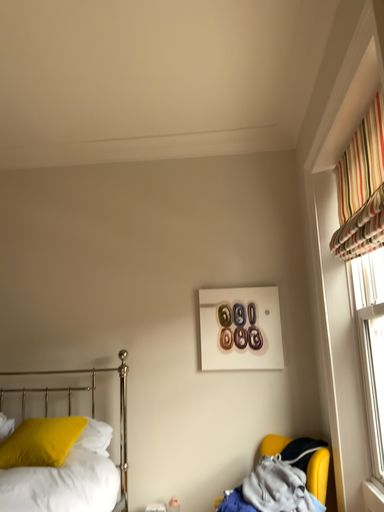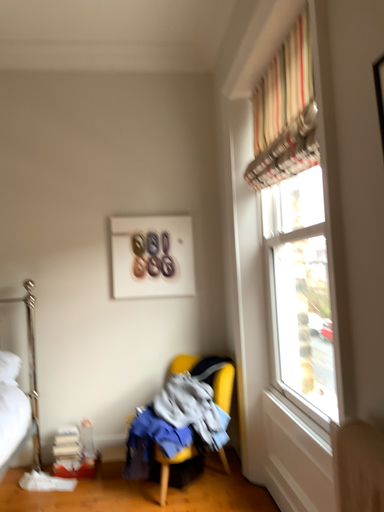
Question: How did the camera likely rotate when shooting the video?

Choices:
 (A) rotated left
 (B) rotated right

Answer: (B)